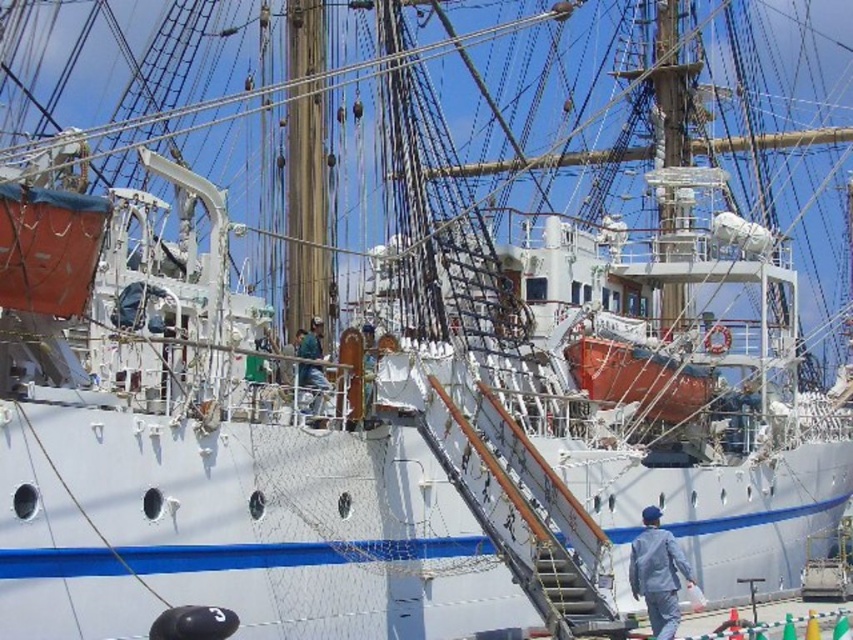
Question: From the image, what is the correct spatial relationship of light blue fabric jacket at lower right in relation to green matte shirt at center?

Choices:
 (A) right
 (B) left

Answer: (A)

Question: Is light blue fabric jacket at lower right further to camera compared to green matte shirt at center?

Choices:
 (A) yes
 (B) no

Answer: (B)

Question: Is light blue fabric jacket at lower right behind green matte shirt at center?

Choices:
 (A) yes
 (B) no

Answer: (B)